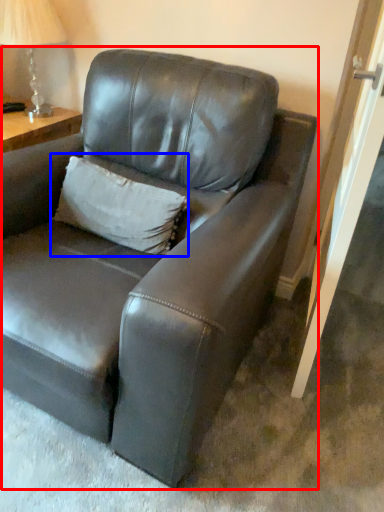
Question: Among these objects, which one is farthest to the camera, studio couch (highlighted by a red box) or pillow (highlighted by a blue box)?

Choices:
 (A) studio couch
 (B) pillow

Answer: (B)